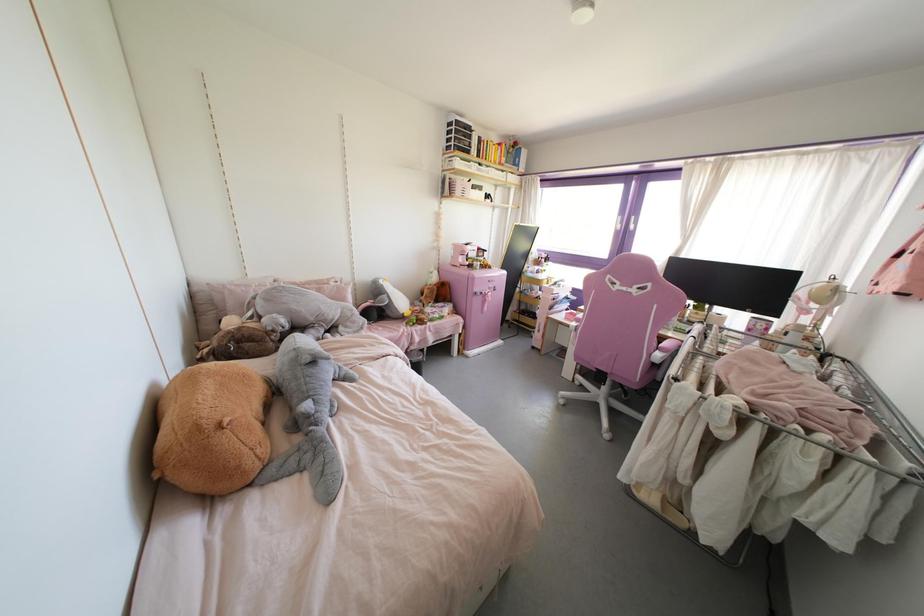
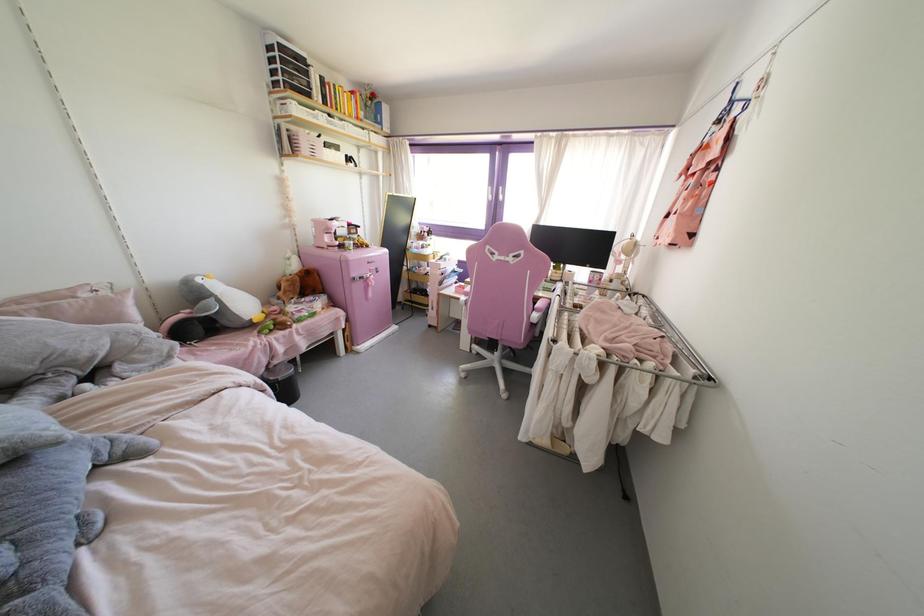
The point at (477, 191) is marked in the first image. Where is the corresponding point in the second image?

(333, 151)